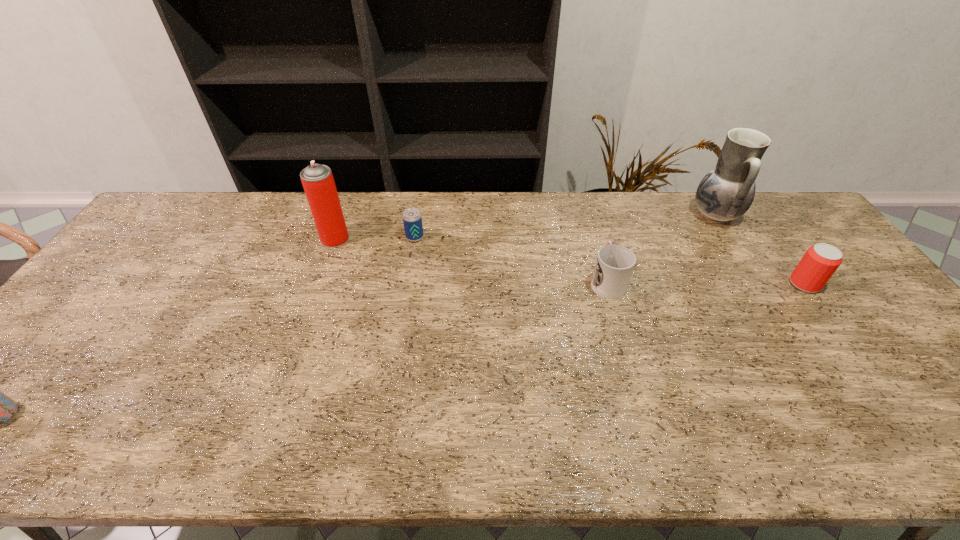
You are a GUI agent. You are given a task and a screenshot of the screen. Output one action in this format:
    pyautogui.click(x=<x>, y=<y>)
    Task: Click on the pitcher
    
    Given the screenshot: What is the action you would take?
    pyautogui.click(x=726, y=192)

Find the location of a particular element. The height and width of the screenshot is (540, 960). aerosol can is located at coordinates (318, 182).

The image size is (960, 540). Identify the location of the second farthest beer can. (819, 263).

Identify the location of the tallest beer can. This screenshot has height=540, width=960. (819, 263).

Locate an element on the screen. The width and height of the screenshot is (960, 540). cup is located at coordinates (615, 263).

Where is `the farthest beer can`? Image resolution: width=960 pixels, height=540 pixels. the farthest beer can is located at coordinates (412, 219).

I want to click on the second beer can from right to left, so click(x=412, y=219).

What are the coordinates of `free spot located 0.050m on the front-facing side of the fifth object from left to right` in the screenshot? It's located at (676, 214).

The width and height of the screenshot is (960, 540). Identify the location of blank space located on the front-facing side of the fifth object from left to right. (649, 214).

At what (x,y) coordinates should I click in order to perform the action: click on vacant region located on the front-facing side of the fifth object from left to right. Please return your answer as a coordinate pair (x, y). The height and width of the screenshot is (540, 960). Looking at the image, I should click on (611, 214).